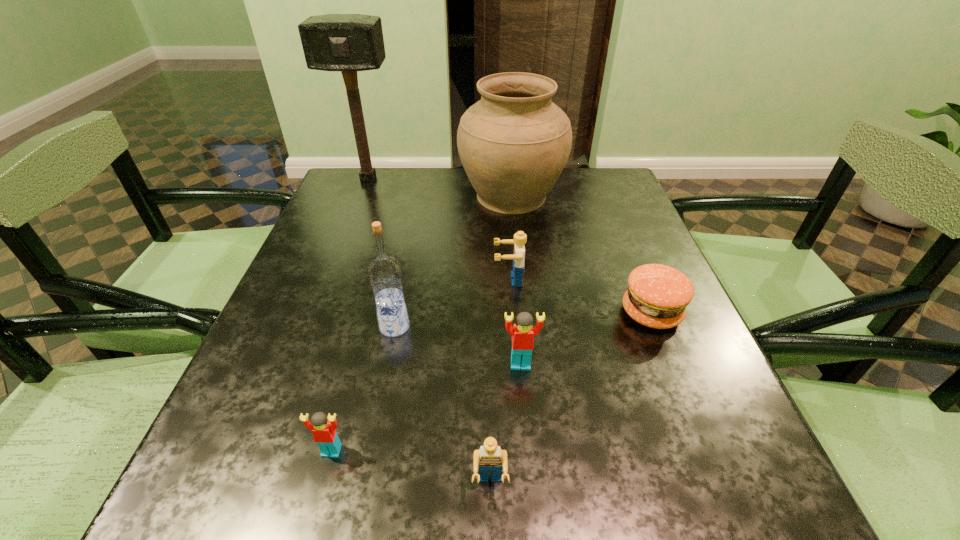
This screenshot has width=960, height=540. I want to click on vacant area that lies between the bigger blue Lego and the nearer blue Lego, so pos(499,382).

This screenshot has width=960, height=540. What are the coordinates of `free area in between the nearer blue Lego and the patty` in the screenshot? It's located at (570, 399).

Identify the location of the second closest object relative to the bigger blue Lego. This screenshot has height=540, width=960. (522, 332).

The height and width of the screenshot is (540, 960). Identify the location of object that is the sixth closest to the second nearest Lego. (514, 143).

Locate which Lego ranks second in proximity to the smaller blue Lego. Please provide its 2D coordinates. Your answer should be formatted as a tuple, i.e. [(x, y)], where the tuple contains the x and y coordinates of a point satisfying the conditions above.

[(323, 428)]

The width and height of the screenshot is (960, 540). I want to click on Lego that is the closest to the rightmost object, so click(522, 332).

Identify the location of free space that satisfies the following two spatial constraints: 1. on the face of the sixth nearest object; 2. on the left side of the rightmost object. This screenshot has height=540, width=960. (511, 313).

The image size is (960, 540). I want to click on blank area in the image that satisfies the following two spatial constraints: 1. on the face of the farthest Lego; 2. on the left side of the rightmost object, so click(511, 313).

Locate an element on the screen. This screenshot has width=960, height=540. free space that satisfies the following two spatial constraints: 1. on the front side of the rightmost object; 2. on the left side of the urn is located at coordinates tap(523, 313).

At what (x,y) coordinates should I click in order to perform the action: click on free space that satisfies the following two spatial constraints: 1. on the front side of the rightmost object; 2. on the left side of the mallet. Please return your answer as a coordinate pair (x, y). This screenshot has width=960, height=540. Looking at the image, I should click on [x=316, y=313].